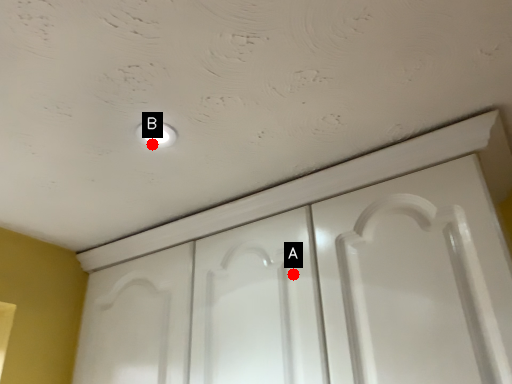
Question: Two points are circled on the image, labeled by A and B beside each circle. Which point is further to the camera?

Choices:
 (A) A is further
 (B) B is further

Answer: (A)